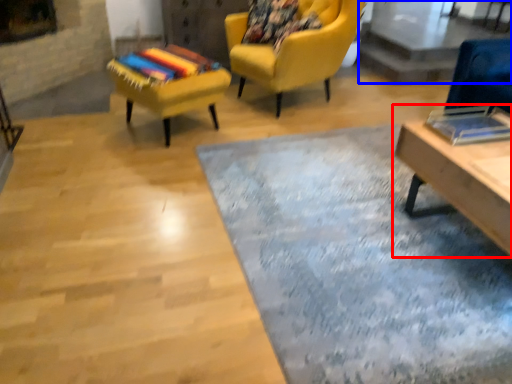
Question: Which point is closer to the camera, table (highlighted by a red box) or glass table (highlighted by a blue box)?

Choices:
 (A) table
 (B) glass table

Answer: (A)